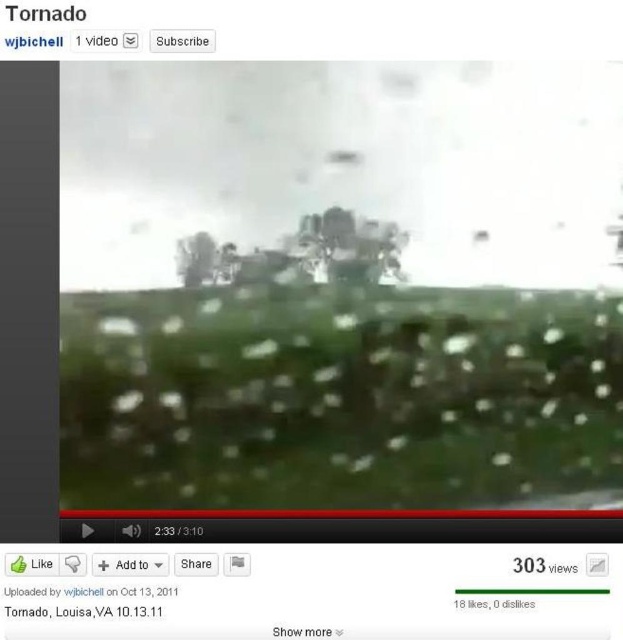
Question: Is green leafy tree at center closer to the viewer compared to transparent text at center?

Choices:
 (A) no
 (B) yes

Answer: (A)

Question: Can you confirm if green leafy tree at center is smaller than transparent text at center?

Choices:
 (A) no
 (B) yes

Answer: (A)

Question: Is green leafy tree at center wider than transparent text at center?

Choices:
 (A) yes
 (B) no

Answer: (A)

Question: Which object is farther from the camera taking this photo?

Choices:
 (A) green leafy tree at center
 (B) transparent text at center

Answer: (A)

Question: Which point is farther to the camera?

Choices:
 (A) (307, 225)
 (B) (158, 612)

Answer: (A)

Question: Which of the following is the farthest from the observer?

Choices:
 (A) (335, 225)
 (B) (93, 612)

Answer: (A)